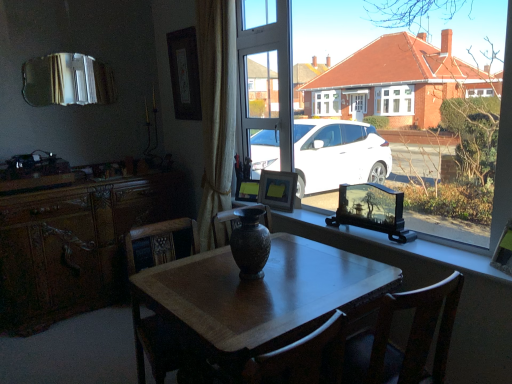
Question: Can you confirm if matte wooden picture frame at center, marked as the 3th picture frame in a left-to-right arrangement, is positioned to the left of matte black vase at center?

Choices:
 (A) yes
 (B) no

Answer: (A)

Question: Is matte wooden picture frame at center, which appears as the third picture frame when viewed from the back, shorter than matte black vase at center?

Choices:
 (A) yes
 (B) no

Answer: (A)

Question: Is matte wooden picture frame at center, marked as the 3th picture frame in a left-to-right arrangement, looking in the opposite direction of matte black vase at center?

Choices:
 (A) yes
 (B) no

Answer: (A)

Question: Does matte wooden picture frame at center, arranged as the second picture frame when viewed from the right, appear on the right side of matte black vase at center?

Choices:
 (A) yes
 (B) no

Answer: (B)

Question: Is matte black vase at center a part of matte wooden picture frame at center, arranged as the 2th picture frame when viewed from the front?

Choices:
 (A) yes
 (B) no

Answer: (B)

Question: Does matte wooden picture frame at center, arranged as the 2th picture frame when viewed from the front, have a greater width compared to matte black vase at center?

Choices:
 (A) yes
 (B) no

Answer: (B)

Question: Is wooden cabinet at left outside of wooden picture frame at window, the fourth picture frame from the top?

Choices:
 (A) no
 (B) yes

Answer: (B)

Question: Is the position of wooden cabinet at left more distant than that of wooden picture frame at window, marked as the fourth picture frame in a back-to-front arrangement?

Choices:
 (A) yes
 (B) no

Answer: (A)

Question: Considering the relative sizes of wooden cabinet at left and wooden picture frame at window, the 1th picture frame viewed from the right, in the image provided, is wooden cabinet at left bigger than wooden picture frame at window, the 1th picture frame viewed from the right,?

Choices:
 (A) no
 (B) yes

Answer: (B)

Question: From the image's perspective, is wooden cabinet at left on top of wooden picture frame at window, arranged as the 1th picture frame when ordered from the bottom?

Choices:
 (A) no
 (B) yes

Answer: (A)

Question: From a real-world perspective, is wooden cabinet at left under wooden picture frame at window, the 1th picture frame viewed from the right?

Choices:
 (A) yes
 (B) no

Answer: (A)

Question: Is wooden cabinet at left positioned far away from wooden picture frame at window, the 4th picture frame when ordered from left to right?

Choices:
 (A) yes
 (B) no

Answer: (A)

Question: Is wooden picture frame at window, the fourth picture frame from the top, oriented away from matte brown vase at center?

Choices:
 (A) no
 (B) yes

Answer: (A)